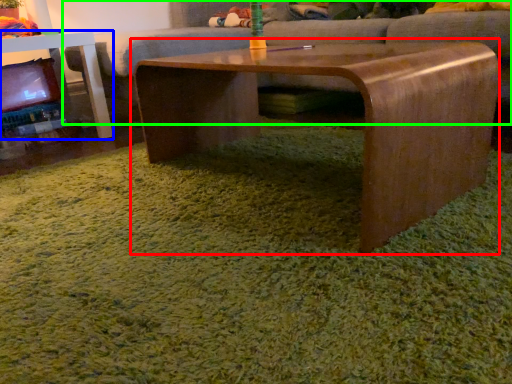
Question: Considering the real-world distances, which object is closest to coffee table (highlighted by a red box)? table (highlighted by a blue box) or studio couch (highlighted by a green box).

Choices:
 (A) table
 (B) studio couch

Answer: (B)